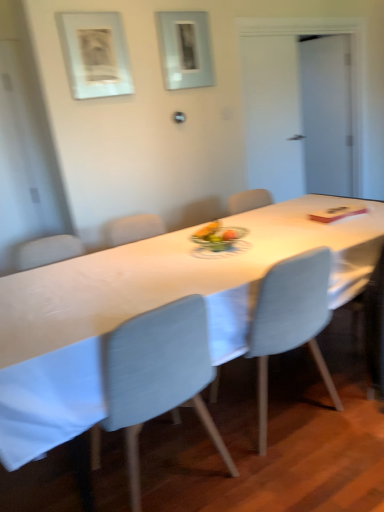
Question: Considering the positions of light blue fabric chair at center, placed as the first chair when sorted from right to left, and transparent glass door at upper right in the image, is light blue fabric chair at center, placed as the first chair when sorted from right to left, taller or shorter than transparent glass door at upper right?

Choices:
 (A) tall
 (B) short

Answer: (B)

Question: From a real-world perspective, is light blue fabric chair at center, placed as the first chair when sorted from right to left, physically located above or below transparent glass door at upper right?

Choices:
 (A) below
 (B) above

Answer: (A)

Question: Which is nearer to the white glossy table at center?

Choices:
 (A) light blue fabric chair at center, placed as the first chair when sorted from right to left
 (B) transparent glass door at upper right
 (C) white matte picture frame at upper left, the second picture frame when ordered from right to left
 (D) light blue fabric chair at center, which appears as the second chair when viewed from the right
 (E) metallic gray picture frame at upper center, placed as the 1th picture frame when sorted from back to front

Answer: (D)

Question: Considering the real-world distances, which object is farthest from the white glossy table at center?

Choices:
 (A) transparent glass door at upper right
 (B) light blue fabric chair at center, the 1th chair when ordered from left to right
 (C) light blue fabric chair at center, placed as the first chair when sorted from right to left
 (D) white matte picture frame at upper left, the second picture frame when ordered from right to left
 (E) metallic gray picture frame at upper center, positioned as the 1th picture frame in right-to-left order

Answer: (A)